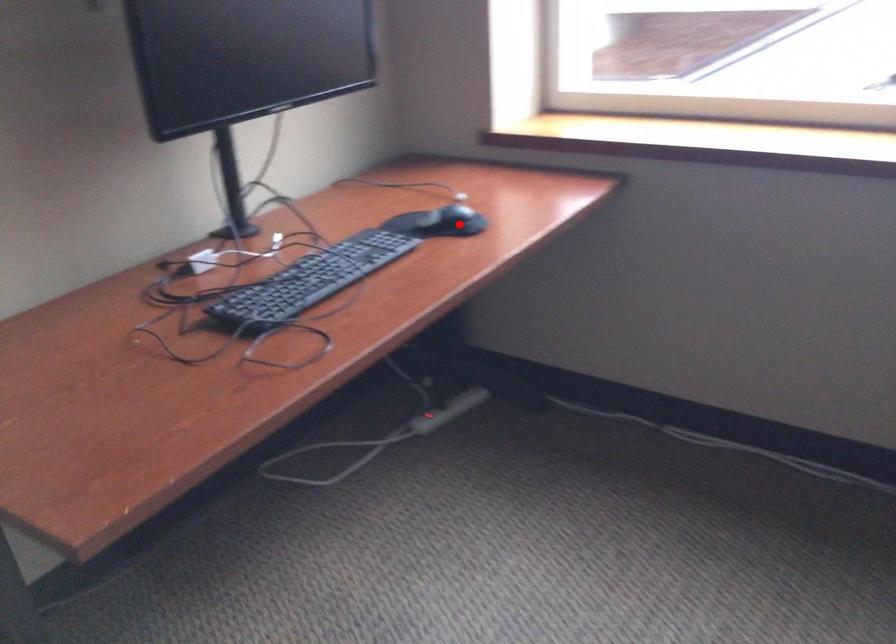
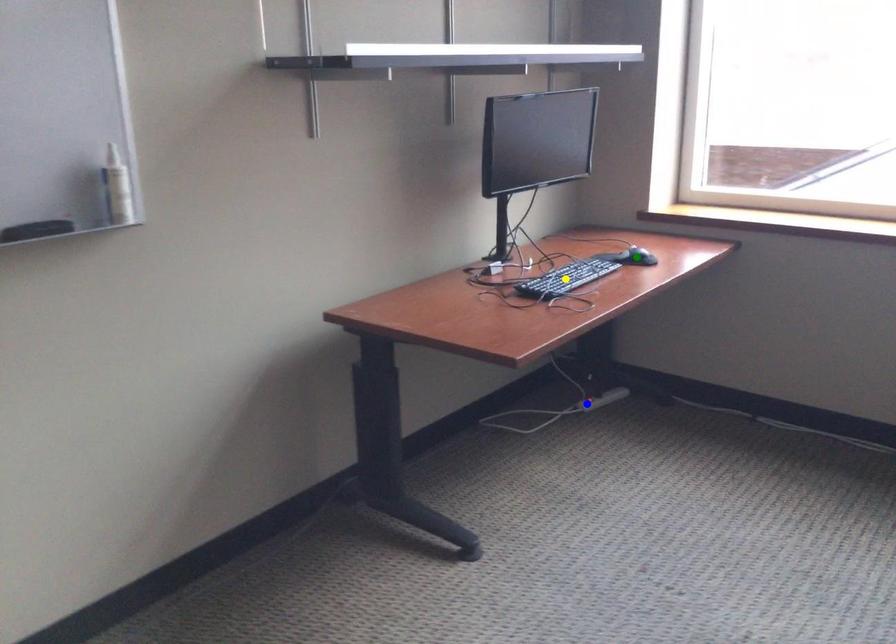
Question: I am providing you with two images of the same scene from different viewpoints. A red point is marked on the first image. You are given multiple points on the second image. Which spot in image 2 lines up with the point in image 1?

Choices:
 (A) green point
 (B) yellow point
 (C) blue point

Answer: (A)